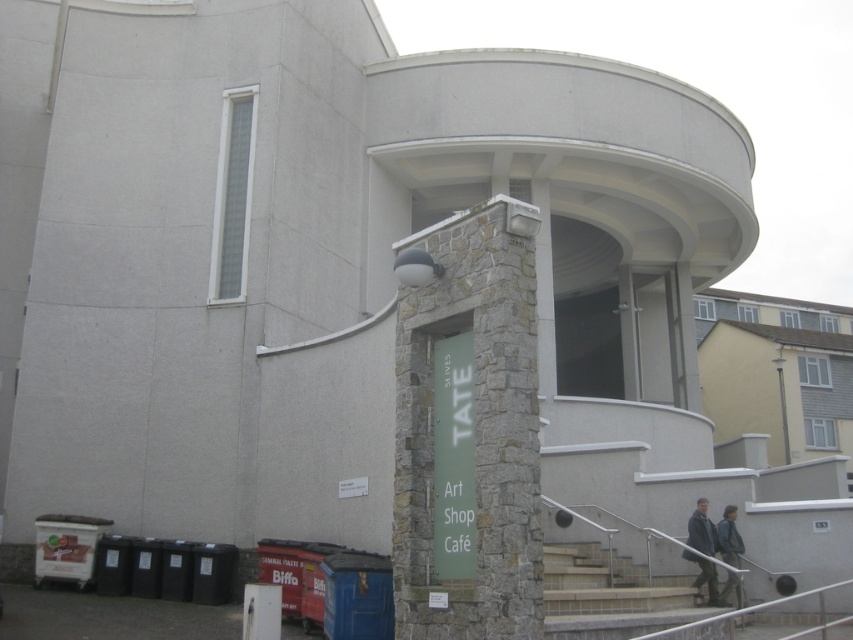
Question: Is smooth concrete stairs at lower center further to the viewer compared to dark gray jacket at lower right?

Choices:
 (A) no
 (B) yes

Answer: (A)

Question: Which point is farther from the camera taking this photo?

Choices:
 (A) (703, 525)
 (B) (735, 589)
 (C) (544, 557)

Answer: (A)

Question: Among these objects, which one is nearest to the camera?

Choices:
 (A) smooth concrete stairs at lower center
 (B) dark gray jacket at lower right
 (C) green fabric jacket at lower right

Answer: (A)

Question: Which of the following is the farthest from the observer?

Choices:
 (A) smooth concrete stairs at lower center
 (B) dark gray jacket at lower right
 (C) green fabric jacket at lower right

Answer: (C)

Question: Is smooth concrete stairs at lower center in front of dark gray jacket at lower right?

Choices:
 (A) yes
 (B) no

Answer: (A)

Question: Does smooth concrete stairs at lower center appear on the right side of dark gray jacket at lower right?

Choices:
 (A) yes
 (B) no

Answer: (B)